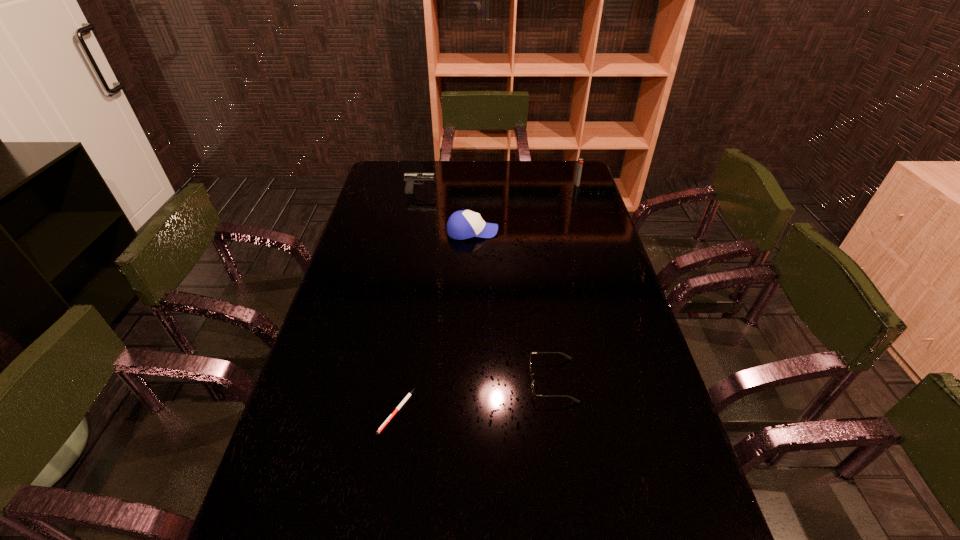
You are a GUI agent. You are given a task and a screenshot of the screen. Output one action in this format:
    pyautogui.click(x=<x>, y=<y>)
    Task: Click on the free region at the left edge of the desktop
    
    Given the screenshot: What is the action you would take?
    pyautogui.click(x=344, y=296)

I want to click on vacant space at the right edge of the desktop, so click(x=572, y=280).

In the image, there is a desktop. Where is `free region at the far left corner`? This screenshot has height=540, width=960. free region at the far left corner is located at coordinates (382, 175).

Where is `vacant point at the far right corner`? This screenshot has height=540, width=960. vacant point at the far right corner is located at coordinates (558, 184).

The width and height of the screenshot is (960, 540). Find the location of `unoccupied position between the tallest object and the third object from left to right`. unoccupied position between the tallest object and the third object from left to right is located at coordinates (525, 208).

Where is `vacant area that lies between the tallest object and the fourth nearest object`? The image size is (960, 540). vacant area that lies between the tallest object and the fourth nearest object is located at coordinates (498, 188).

At what (x,y) coordinates should I click in order to perform the action: click on vacant point located between the baseball cap and the shortest object. Please return your answer as a coordinate pair (x, y). This screenshot has width=960, height=540. Looking at the image, I should click on (435, 321).

At what (x,y) coordinates should I click in order to perform the action: click on vacant region between the pistol and the pen. Please return your answer as a coordinate pair (x, y). Looking at the image, I should click on (408, 302).

Find the location of a particular element. free space between the fourth tallest object and the shortest object is located at coordinates (474, 396).

Identify the location of free point between the fourth nearest object and the spectacles. Image resolution: width=960 pixels, height=540 pixels. coord(487,286).